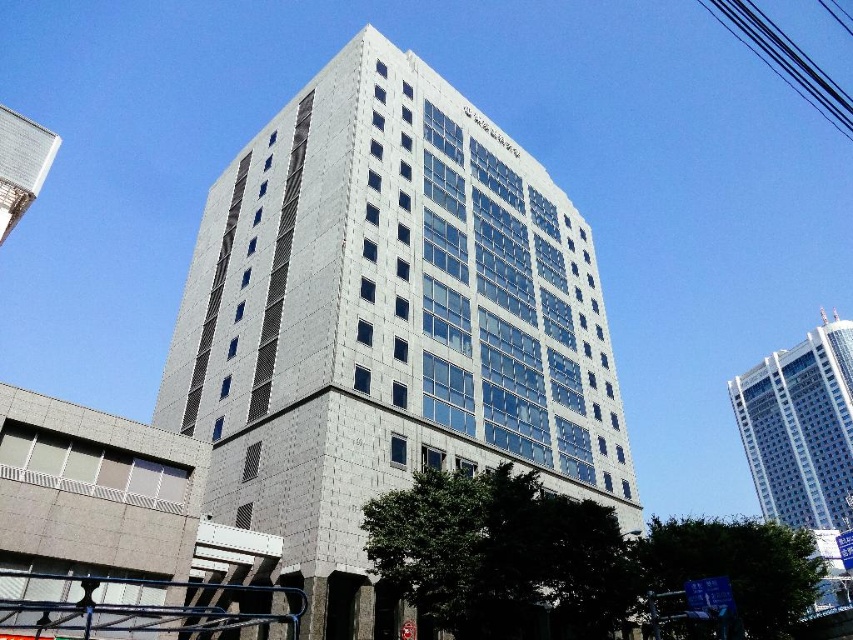
You are an urban planner reviewing the building plans. You notice the white glass building at upper right and the metallic silver tower at upper left in the design. Which structure occupies more space in the architectural layout?

The white glass building at upper right is larger in size than the metallic silver tower at upper left, so it occupies more space in the architectural layout.

You are a drone operator who needs to fly a drone from the metallic silver tower at upper left to the white glass building at center. The drone has a maximum flight range of 20 meters. Can the drone reach its destination without needing a recharge?

The distance between the metallic silver tower at upper left and the white glass building at center is 23.81 meters, which exceeds the drone operator stated maximum flight range of 20 meters. Therefore, the drone cannot reach the white glass building at center without needing a recharge.

You are standing in front of the modern, multi story building with a sleek geometric design. You see a point at (386, 324). What does this point represent?

The point at (386, 324) represents the white glass building at center.